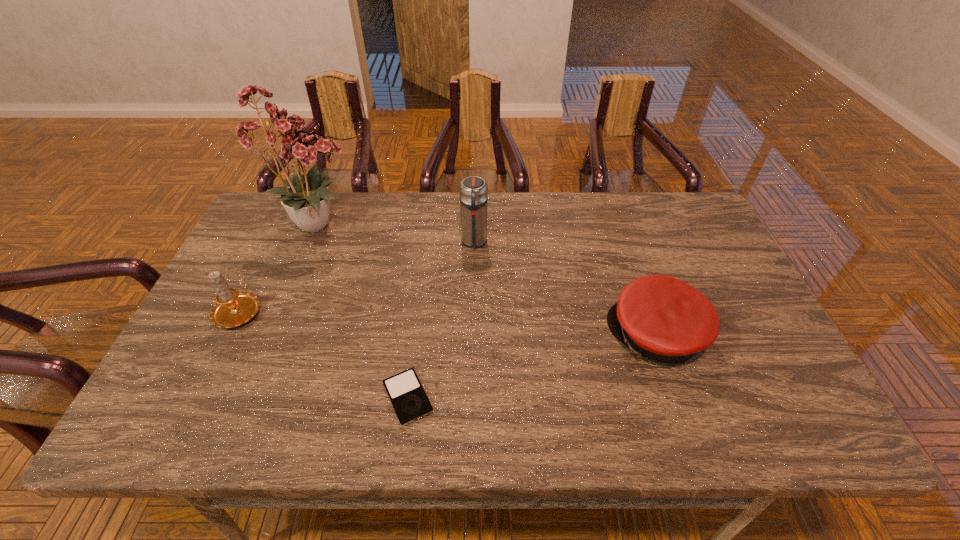
What are the coordinates of `object that is positioned at the far left corner` in the screenshot? It's located at (307, 199).

I want to click on vacant area at the far edge, so click(x=387, y=225).

The image size is (960, 540). I want to click on free space at the near edge of the desktop, so click(x=589, y=407).

You are a GUI agent. You are given a task and a screenshot of the screen. Output one action in this format:
    pyautogui.click(x=<x>, y=<y>)
    Task: Click on the free spot at the left edge of the desktop
    
    Given the screenshot: What is the action you would take?
    pyautogui.click(x=272, y=293)

The image size is (960, 540). Identify the location of vacant space at the far right corner. (681, 194).

Find the location of a particular element. vacant space in between the shortest object and the second tallest object is located at coordinates (x=441, y=320).

Where is `empty location between the fourth shortest object and the shortest object`? This screenshot has width=960, height=540. empty location between the fourth shortest object and the shortest object is located at coordinates (441, 320).

Locate an element on the screen. The height and width of the screenshot is (540, 960). vacant region between the cap and the third tallest object is located at coordinates (448, 323).

You are a GUI agent. You are given a task and a screenshot of the screen. Output one action in this format:
    pyautogui.click(x=<x>, y=<y>)
    Task: Click on the free space between the candle and the second object from right to left
    The width and height of the screenshot is (960, 540).
    Given the screenshot: What is the action you would take?
    pyautogui.click(x=357, y=276)

The image size is (960, 540). In order to click on vacant area between the thermos bottle and the flower arrangement in this screenshot , I will do `click(396, 233)`.